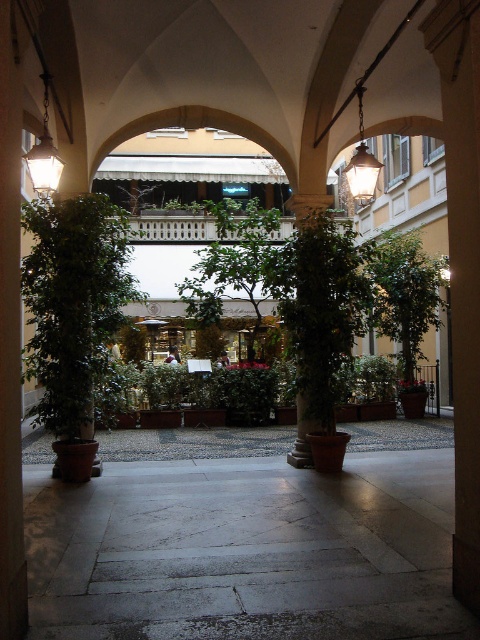
Is point (210, 209) positioned before point (54, 161)?

No.

In the scene shown: Is green leafy tree at center below matte white lamp at upper left?

Yes.

The width and height of the screenshot is (480, 640). What do you see at coordinates (233, 262) in the screenshot?
I see `green leafy tree at center` at bounding box center [233, 262].

At what (x,y) coordinates should I click in order to perform the action: click on green leafy tree at center. Please return your answer as a coordinate pair (x, y). Looking at the image, I should click on (233, 262).

Does matte white lamp at upper left have a larger size compared to matte brass lantern at upper center?

Actually, matte white lamp at upper left might be smaller than matte brass lantern at upper center.

Between matte white lamp at upper left and matte brass lantern at upper center, which one has less height?

Standing shorter between the two is matte white lamp at upper left.

At what (x,y) coordinates should I click in order to perform the action: click on matte white lamp at upper left. Please return your answer as a coordinate pair (x, y). The image size is (480, 640). Looking at the image, I should click on (44, 154).

You are a GUI agent. You are given a task and a screenshot of the screen. Output one action in this format:
    pyautogui.click(x=<x>, y=<y>)
    Task: Click on the matte white lamp at upper left
    The height and width of the screenshot is (640, 480).
    Given the screenshot: What is the action you would take?
    pyautogui.click(x=44, y=154)

Which is in front, point (229, 260) or point (360, 173)?

Point (360, 173) is in front.

Who is positioned more to the right, green leafy tree at center or matte brass lantern at upper center?

matte brass lantern at upper center

You are a GUI agent. You are given a task and a screenshot of the screen. Output one action in this format:
    pyautogui.click(x=<x>, y=<y>)
    Task: Click on the green leafy tree at center
    This screenshot has width=480, height=640.
    Given the screenshot: What is the action you would take?
    pyautogui.click(x=233, y=262)

What are the coordinates of `green leafy tree at center` in the screenshot? It's located at (233, 262).